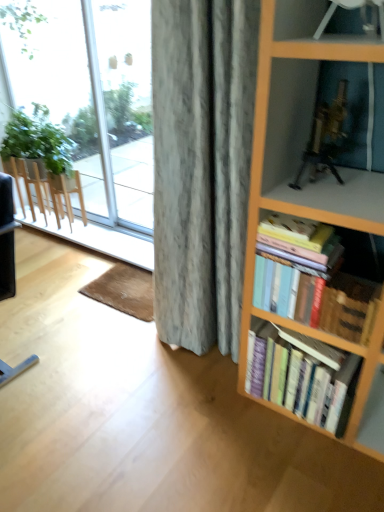
Question: Does transparent glass window at upper left have a smaller size compared to hardcover books at right, which is the 2th book from bottom to top?

Choices:
 (A) no
 (B) yes

Answer: (A)

Question: Does transparent glass window at upper left have a lesser height compared to hardcover books at right, which is the 2th book from bottom to top?

Choices:
 (A) yes
 (B) no

Answer: (B)

Question: Is transparent glass window at upper left to the left of hardcover books at right, the 1th book when ordered from top to bottom, from the viewer's perspective?

Choices:
 (A) yes
 (B) no

Answer: (A)

Question: From the image's perspective, is transparent glass window at upper left over hardcover books at right, which is the 2th book from bottom to top?

Choices:
 (A) no
 (B) yes

Answer: (B)

Question: Is transparent glass window at upper left next to hardcover books at right, which is the 2th book from bottom to top?

Choices:
 (A) no
 (B) yes

Answer: (A)

Question: Is the position of transparent glass window at upper left less distant than that of hardcover books at right, the 1th book when ordered from top to bottom?

Choices:
 (A) yes
 (B) no

Answer: (B)

Question: Is hardcover books at right, which is the 2th book from bottom to top, closer to the viewer compared to hardcover books at right, the 1th book when ordered from bottom to top?

Choices:
 (A) yes
 (B) no

Answer: (A)

Question: From the image's perspective, is hardcover books at right, which is the 2th book from bottom to top, over hardcover books at right, acting as the 2th book starting from the top?

Choices:
 (A) no
 (B) yes

Answer: (B)

Question: From the image's perspective, is hardcover books at right, which is the 2th book from bottom to top, beneath hardcover books at right, acting as the 2th book starting from the top?

Choices:
 (A) yes
 (B) no

Answer: (B)

Question: Is hardcover books at right, the 1th book when ordered from bottom to top, surrounded by hardcover books at right, the 1th book when ordered from top to bottom?

Choices:
 (A) no
 (B) yes

Answer: (A)

Question: Does hardcover books at right, which is the 2th book from bottom to top, appear on the left side of hardcover books at right, the 1th book when ordered from bottom to top?

Choices:
 (A) no
 (B) yes

Answer: (B)

Question: Is hardcover books at right, the 1th book when ordered from top to bottom, behind hardcover books at right, acting as the 2th book starting from the top?

Choices:
 (A) no
 (B) yes

Answer: (A)

Question: Is hardcover books at right, acting as the 2th book starting from the top, oriented towards transparent glass door at left?

Choices:
 (A) yes
 (B) no

Answer: (B)